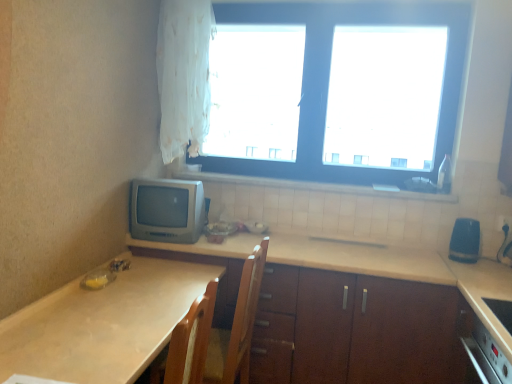
This screenshot has height=384, width=512. I want to click on blue rubber eraser at right, which is the second appliance from left to right, so click(465, 240).

How much space does blue rubber eraser at right, placed as the first appliance when sorted from right to left, occupy horizontally?

blue rubber eraser at right, placed as the first appliance when sorted from right to left, is 24.26 centimeters in width.

Measure the distance between white plastic window at upper center and camera.

They are 8.13 feet apart.

Image resolution: width=512 pixels, height=384 pixels. What do you see at coordinates (504, 223) in the screenshot? I see `white plastic electric outlet at lower right` at bounding box center [504, 223].

Describe the element at coordinates (167, 210) in the screenshot. I see `matte gray crt monitor at left, the 1th appliance from the left` at that location.

Describe the element at coordinates (313, 186) in the screenshot. I see `white tile at upper center` at that location.

Where is `blue rubber eraser at right, which is the second appliance from left to right`? The width and height of the screenshot is (512, 384). blue rubber eraser at right, which is the second appliance from left to right is located at coordinates (465, 240).

From their relative heights in the image, would you say beige laminate countertop at center, which is counted as the second countertop, starting from the left, is taller or shorter than white plastic electric outlet at lower right?

beige laminate countertop at center, which is counted as the second countertop, starting from the left, is taller than white plastic electric outlet at lower right.

I want to click on the 2nd countertop positioned below the white plastic electric outlet at lower right (from the image's perspective), so click(408, 281).

Is beige laminate countertop at center, which is counted as the second countertop, starting from the left, located outside white plastic electric outlet at lower right?

Indeed, beige laminate countertop at center, which is counted as the second countertop, starting from the left, is completely outside white plastic electric outlet at lower right.

From a real-world perspective, is white plastic window at upper center physically below white tile at upper center?

Incorrect, from a real-world perspective, white plastic window at upper center is higher than white tile at upper center.

Considering the points (390, 104) and (206, 177), which point is behind, point (390, 104) or point (206, 177)?

The point (390, 104) is more distant.

How many degrees apart are the facing directions of white plastic window at upper center and white tile at upper center?

They differ by 1.74 degrees in their facing directions.

Is white plastic window at upper center to the left or to the right of white tile at upper center in the image?

white plastic window at upper center is to the right of white tile at upper center.

Is white sheer curtain at upper left with white plastic electric outlet at lower right?

No.

From the image's perspective, is white sheer curtain at upper left on top of white plastic electric outlet at lower right?

Yes, from the image's perspective, white sheer curtain at upper left is on top of white plastic electric outlet at lower right.

Is white sheer curtain at upper left facing towards white plastic electric outlet at lower right?

No, white sheer curtain at upper left is not aimed at white plastic electric outlet at lower right.

You are a GUI agent. You are given a task and a screenshot of the screen. Output one action in this format:
    pyautogui.click(x=<x>, y=<y>)
    Task: Click on the curtain on the left of white plastic electric outlet at lower right
    The width and height of the screenshot is (512, 384).
    Given the screenshot: What is the action you would take?
    pyautogui.click(x=184, y=75)

Considering the relative sizes of beige laminate countertop at lower left, the first countertop viewed from the left, and matte gray crt monitor at left, the 1th appliance from the left, in the image provided, is beige laminate countertop at lower left, the first countertop viewed from the left, wider than matte gray crt monitor at left, the 1th appliance from the left,?

Yes.

Is beige laminate countertop at lower left, positioned as the 2th countertop in right-to-left order, positioned with its back to matte gray crt monitor at left, the 1th appliance from the left?

That's not correct — beige laminate countertop at lower left, positioned as the 2th countertop in right-to-left order, is not looking away from matte gray crt monitor at left, the 1th appliance from the left.

What's the angular difference between beige laminate countertop at lower left, positioned as the 2th countertop in right-to-left order, and matte gray crt monitor at left, the 1th appliance from the left,'s facing directions?

The angular difference between beige laminate countertop at lower left, positioned as the 2th countertop in right-to-left order, and matte gray crt monitor at left, the 1th appliance from the left, is 90.8 degrees.

How far apart are beige laminate countertop at lower left, the first countertop viewed from the left, and matte gray crt monitor at left, the second appliance viewed from the right?

The distance of beige laminate countertop at lower left, the first countertop viewed from the left, from matte gray crt monitor at left, the second appliance viewed from the right, is 19.51 inches.

Is white sheer curtain at upper left looking in the opposite direction of beige laminate countertop at lower left, the first countertop viewed from the left?

No.

How many degrees apart are the facing directions of white sheer curtain at upper left and beige laminate countertop at lower left, positioned as the 2th countertop in right-to-left order?

88.7 degrees.

In the scene shown: Which of these two, white sheer curtain at upper left or beige laminate countertop at lower left, positioned as the 2th countertop in right-to-left order, stands shorter?

beige laminate countertop at lower left, positioned as the 2th countertop in right-to-left order, is shorter.

Does beige laminate countertop at lower left, positioned as the 2th countertop in right-to-left order, appear on the right side of white plastic window at upper center?

In fact, beige laminate countertop at lower left, positioned as the 2th countertop in right-to-left order, is to the left of white plastic window at upper center.

Is beige laminate countertop at lower left, positioned as the 2th countertop in right-to-left order, turned away from white plastic window at upper center?

No, beige laminate countertop at lower left, positioned as the 2th countertop in right-to-left order,'s orientation is not away from white plastic window at upper center.

Which is nearer, [132,303] or [302,57]?

Clearly, point [132,303] is closer to the camera than point [302,57].

What's the angular difference between beige laminate countertop at lower left, positioned as the 2th countertop in right-to-left order, and white plastic window at upper center's facing directions?

The angle between the facing direction of beige laminate countertop at lower left, positioned as the 2th countertop in right-to-left order, and the facing direction of white plastic window at upper center is 90.8 degrees.

Is white tile at upper center wider or thinner than beige laminate countertop at lower left, the first countertop viewed from the left?

In the image, white tile at upper center appears to be more narrow than beige laminate countertop at lower left, the first countertop viewed from the left.

How many degrees apart are the facing directions of white tile at upper center and beige laminate countertop at lower left, positioned as the 2th countertop in right-to-left order?

white tile at upper center and beige laminate countertop at lower left, positioned as the 2th countertop in right-to-left order, are facing 89.1 degrees away from each other.

Does white tile at upper center turn towards beige laminate countertop at lower left, the first countertop viewed from the left?

No, white tile at upper center is not aimed at beige laminate countertop at lower left, the first countertop viewed from the left.

Find the location of a particular element. The width and height of the screenshot is (512, 384). electric outlet behind the beige laminate countertop at center, which is counted as the second countertop, starting from the left is located at coordinates (504, 223).

In order to click on window in front of the white tile at upper center in this screenshot , I will do `click(336, 92)`.

Based on their spatial positions, is white plastic electric outlet at lower right or white sheer curtain at upper left further from blue rubber eraser at right, placed as the first appliance when sorted from right to left?

white sheer curtain at upper left.

When comparing their distances from beige laminate countertop at center, which is counted as the second countertop, starting from the left, does white sheer curtain at upper left or white tile at upper center seem further?

Based on the image, white sheer curtain at upper left appears to be further to beige laminate countertop at center, which is counted as the second countertop, starting from the left.

Which object lies nearer to the anchor point beige laminate countertop at center, which appears as the 1th countertop when viewed from the right, matte gray crt monitor at left, the 1th appliance from the left, or blue rubber eraser at right, placed as the first appliance when sorted from right to left?

Among the two, matte gray crt monitor at left, the 1th appliance from the left, is located nearer to beige laminate countertop at center, which appears as the 1th countertop when viewed from the right.

Considering their positions, is matte gray crt monitor at left, the 1th appliance from the left, positioned closer to beige laminate countertop at lower left, positioned as the 2th countertop in right-to-left order, than blue rubber eraser at right, which is the second appliance from left to right?

matte gray crt monitor at left, the 1th appliance from the left, is closer to beige laminate countertop at lower left, positioned as the 2th countertop in right-to-left order.

Estimate the real-world distances between objects in this image. Which object is further from beige laminate countertop at lower left, positioned as the 2th countertop in right-to-left order, white tile at upper center or beige laminate countertop at center, which is counted as the second countertop, starting from the left?

Among the two, white tile at upper center is located further to beige laminate countertop at lower left, positioned as the 2th countertop in right-to-left order.

Consider the image. Based on their spatial positions, is beige laminate countertop at lower left, the first countertop viewed from the left, or blue rubber eraser at right, placed as the first appliance when sorted from right to left, closer to matte gray crt monitor at left, the 1th appliance from the left?

beige laminate countertop at lower left, the first countertop viewed from the left, is positioned closer to the anchor matte gray crt monitor at left, the 1th appliance from the left.

Based on their spatial positions, is white plastic electric outlet at lower right or white tile at upper center closer to beige laminate countertop at center, which appears as the 1th countertop when viewed from the right?

white tile at upper center is positioned closer to the anchor beige laminate countertop at center, which appears as the 1th countertop when viewed from the right.

From the picture: When comparing their distances from white sheer curtain at upper left, does blue rubber eraser at right, placed as the first appliance when sorted from right to left, or white tile at upper center seem closer?

Among the two, white tile at upper center is located nearer to white sheer curtain at upper left.

The width and height of the screenshot is (512, 384). Identify the location of window between white tile at upper center and blue rubber eraser at right, which is the second appliance from left to right, from left to right. (336, 92).

At what (x,y) coordinates should I click in order to perform the action: click on appliance between beige laminate countertop at center, which appears as the 1th countertop when viewed from the right, and matte gray crt monitor at left, the second appliance viewed from the right, in the front-back direction. Please return your answer as a coordinate pair (x, y). This screenshot has height=384, width=512. Looking at the image, I should click on (465, 240).

Locate an element on the screen. The image size is (512, 384). curtain between matte gray crt monitor at left, the second appliance viewed from the right, and white plastic electric outlet at lower right from left to right is located at coordinates (184, 75).

The height and width of the screenshot is (384, 512). Identify the location of window positioned between beige laminate countertop at center, which appears as the 1th countertop when viewed from the right, and white plastic electric outlet at lower right from near to far. (336, 92).